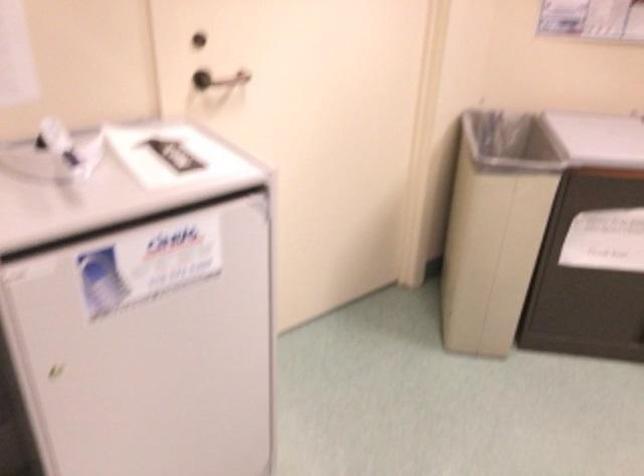
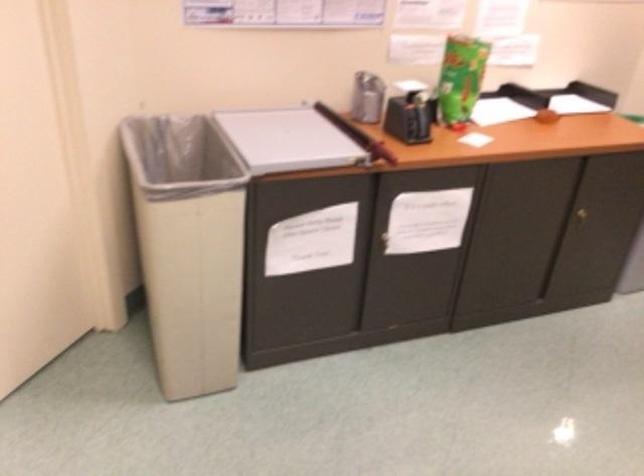
Question: Based on the continuous images, in which direction is the camera rotating? Reply with the corresponding letter.

Choices:
 (A) Left
 (B) Right
 (C) Up
 (D) Down

Answer: (B)